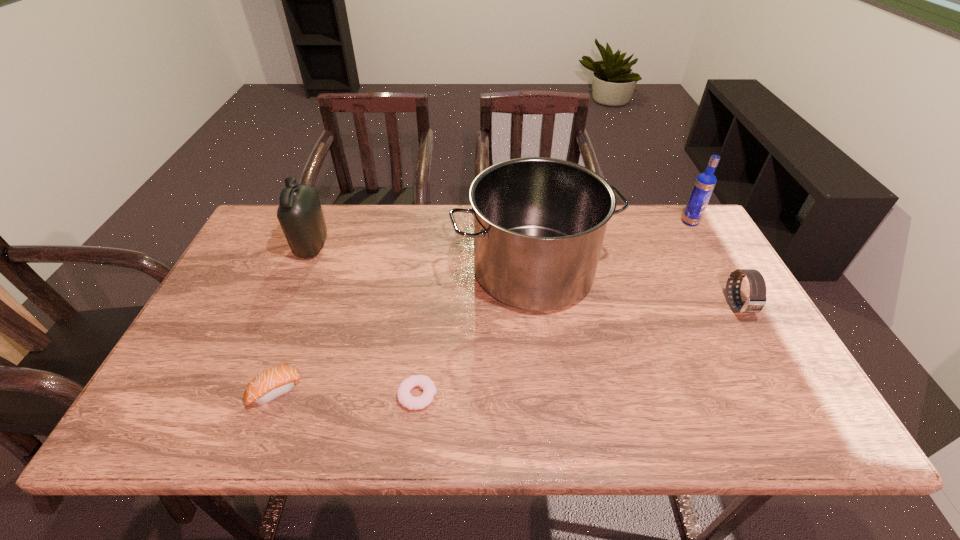
Where is `watch at the right edge`? Image resolution: width=960 pixels, height=540 pixels. watch at the right edge is located at coordinates (756, 301).

This screenshot has height=540, width=960. What are the coordinates of `object located at the far left corner` in the screenshot? It's located at (299, 213).

I want to click on object situated at the far right corner, so click(x=704, y=185).

At what (x,y) coordinates should I click in order to perform the action: click on free space at the far edge. Please return your answer as a coordinate pair (x, y). Looking at the image, I should click on (393, 227).

Find the location of a particular element. free location at the near edge is located at coordinates (670, 427).

Locate an element on the screen. This screenshot has width=960, height=540. vacant space at the left edge is located at coordinates (242, 305).

Find the location of `vacant space at the right edge of the desktop`. vacant space at the right edge of the desktop is located at coordinates (700, 253).

Find the location of a particular element. Image resolution: width=960 pixels, height=540 pixels. free region at the near left corner of the desktop is located at coordinates (161, 406).

You are a GUI agent. You are given a task and a screenshot of the screen. Output one action in this format:
    pyautogui.click(x=<x>, y=<y>)
    Task: Click on the free spot at the near right corner of the desktop
    The image size is (960, 540).
    Given the screenshot: What is the action you would take?
    pyautogui.click(x=775, y=406)

Find the location of a particular element. This screenshot has height=540, width=960. vacant area between the saucepan and the fourth tallest object is located at coordinates point(636,289).